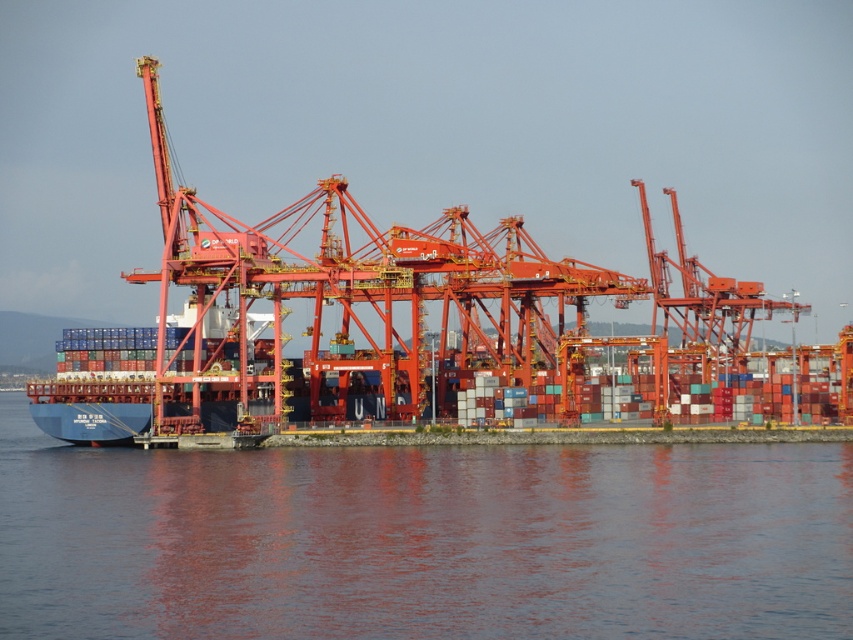
Who is lower down, transparent water at lower center or metallic orange crane at center?

transparent water at lower center is lower down.

Does transparent water at lower center have a lesser width compared to metallic orange crane at center?

Indeed, transparent water at lower center has a lesser width compared to metallic orange crane at center.

Where is `transparent water at lower center`? transparent water at lower center is located at coordinates (422, 540).

You are a GUI agent. You are given a task and a screenshot of the screen. Output one action in this format:
    pyautogui.click(x=<x>, y=<y>)
    Task: Click on the transparent water at lower center
    
    Given the screenshot: What is the action you would take?
    pyautogui.click(x=422, y=540)